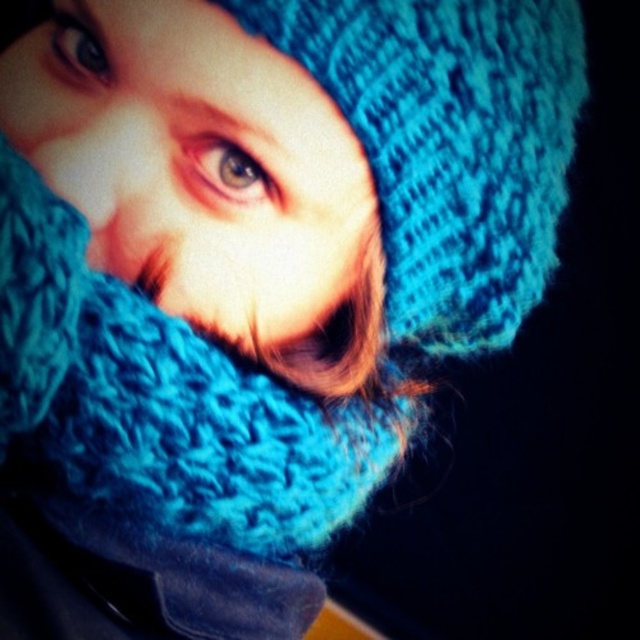
What do you see at coordinates (198, 168) in the screenshot? I see `blue knitted hat at upper center` at bounding box center [198, 168].

Which is behind, point (49, 38) or point (195, 134)?

Point (49, 38)

What do you see at coordinates (198, 168) in the screenshot? I see `blue knitted hat at upper center` at bounding box center [198, 168].

At what (x,y) coordinates should I click in order to perform the action: click on blue knitted hat at upper center. Please return your answer as a coordinate pair (x, y). This screenshot has width=640, height=640. Looking at the image, I should click on (198, 168).

Which of these two, brown matte eye at upper center or matte blue eye at upper left, stands taller?

With more height is matte blue eye at upper left.

What do you see at coordinates (225, 170) in the screenshot? This screenshot has height=640, width=640. I see `brown matte eye at upper center` at bounding box center [225, 170].

Locate an element on the screen. The image size is (640, 640). brown matte eye at upper center is located at coordinates click(225, 170).

How much distance is there between blue knitted hat at upper center and matte blue eye at upper left?

blue knitted hat at upper center is 3.30 inches from matte blue eye at upper left.

Who is lower down, blue knitted hat at upper center or matte blue eye at upper left?

blue knitted hat at upper center is lower down.

The width and height of the screenshot is (640, 640). In order to click on blue knitted hat at upper center in this screenshot , I will do `click(198, 168)`.